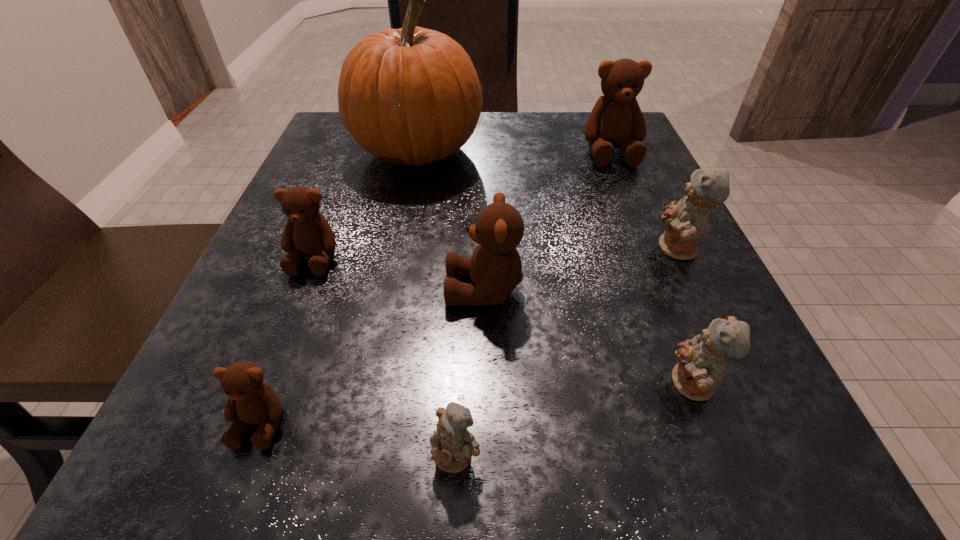
Identify the location of vacant space situated 0.290m on the face of the third smallest brown teddy bear. (250, 290).

Image resolution: width=960 pixels, height=540 pixels. What are the coordinates of `vacant space located 0.110m on the front-facing side of the second blue teddy bear from right to left` in the screenshot? It's located at (580, 386).

Find the location of a particular element. This screenshot has width=960, height=540. vacant space located 0.270m on the front-facing side of the second blue teddy bear from right to left is located at coordinates (449, 386).

Identify the location of free space located 0.190m on the front-facing side of the second blue teddy bear from right to left. The image size is (960, 540). (515, 386).

Where is `vacant space located on the face of the third biggest brown teddy bear`? Image resolution: width=960 pixels, height=540 pixels. vacant space located on the face of the third biggest brown teddy bear is located at coordinates pyautogui.click(x=274, y=361).

At what (x,y) coordinates should I click in order to perform the action: click on pumpkin at the far edge. Please return your answer as a coordinate pair (x, y). Looking at the image, I should click on (411, 96).

At what (x,y) coordinates should I click in order to perform the action: click on teddy bear at the far edge. Please return your answer as a coordinate pair (x, y). Looking at the image, I should click on (616, 121).

What are the coordinates of `pumpkin that is at the left edge` in the screenshot? It's located at click(411, 96).

Find the location of a particular element. The width and height of the screenshot is (960, 540). object that is at the far left corner is located at coordinates (411, 96).

Locate an element on the screen. The width and height of the screenshot is (960, 540). object at the near left corner is located at coordinates (251, 401).